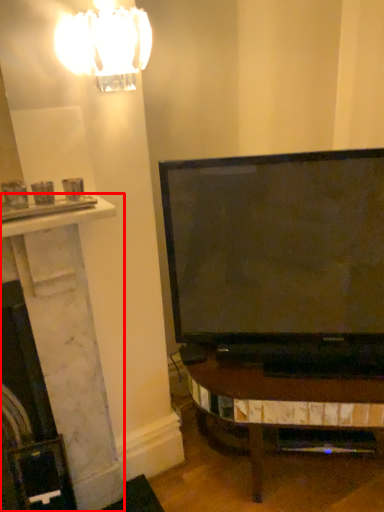
Question: From the image, what is the correct spatial relationship of fireplace (annotated by the red box) in relation to lamp?

Choices:
 (A) left
 (B) right

Answer: (A)